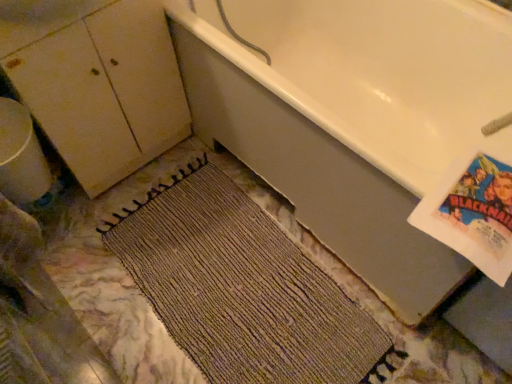
Question: Should I look upward or downward to see white glossy bathtub at upper right?

Choices:
 (A) down
 (B) up

Answer: (B)

Question: Is matte white cabinet at left facing towards white glossy cabinet at upper left?

Choices:
 (A) no
 (B) yes

Answer: (A)

Question: From the image's perspective, is matte white cabinet at left located beneath white glossy cabinet at upper left?

Choices:
 (A) yes
 (B) no

Answer: (A)

Question: Does matte white cabinet at left lie behind white glossy cabinet at upper left?

Choices:
 (A) yes
 (B) no

Answer: (A)

Question: Is matte white cabinet at left in contact with white glossy cabinet at upper left?

Choices:
 (A) no
 (B) yes

Answer: (A)

Question: Is matte white cabinet at left positioned before white glossy cabinet at upper left?

Choices:
 (A) no
 (B) yes

Answer: (A)

Question: Is matte white cabinet at left completely or partially outside of white glossy cabinet at upper left?

Choices:
 (A) yes
 (B) no

Answer: (A)

Question: Does brown woven mat at center have a smaller size compared to white glossy cabinet at upper left?

Choices:
 (A) no
 (B) yes

Answer: (A)

Question: From the image's perspective, would you say brown woven mat at center is shown under white glossy cabinet at upper left?

Choices:
 (A) no
 (B) yes

Answer: (B)

Question: From the image's perspective, is brown woven mat at center on top of white glossy cabinet at upper left?

Choices:
 (A) no
 (B) yes

Answer: (A)

Question: Considering the relative positions of brown woven mat at center and white glossy cabinet at upper left in the image provided, is brown woven mat at center to the left of white glossy cabinet at upper left from the viewer's perspective?

Choices:
 (A) no
 (B) yes

Answer: (A)

Question: Could you tell me if brown woven mat at center is facing white glossy cabinet at upper left?

Choices:
 (A) no
 (B) yes

Answer: (A)

Question: Is brown woven mat at center thinner than white glossy cabinet at upper left?

Choices:
 (A) no
 (B) yes

Answer: (A)

Question: Is white glossy bathtub at upper right to the right of white glossy cabinet at upper left from the viewer's perspective?

Choices:
 (A) yes
 (B) no

Answer: (A)